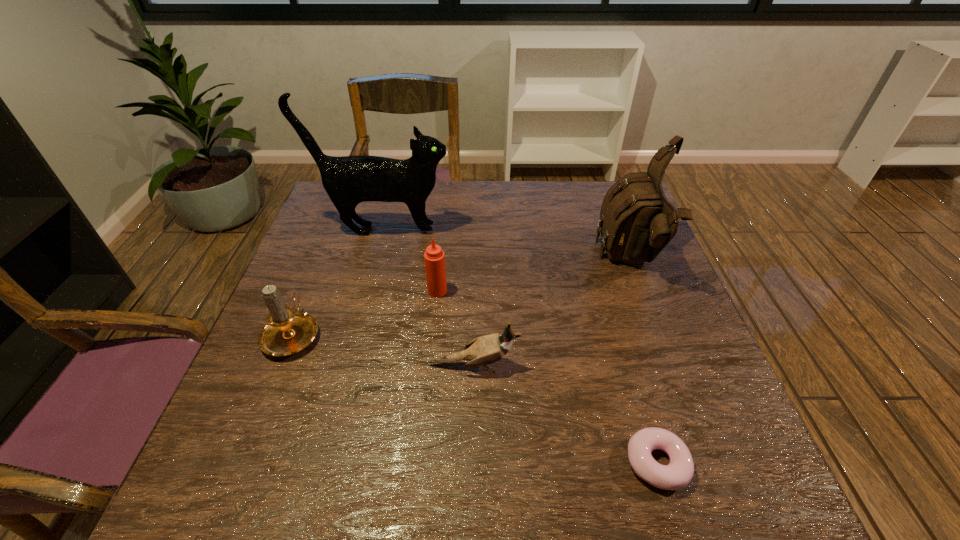
The image size is (960, 540). Identify the location of free space between the candle and the tallest object. [x=338, y=282].

In order to click on vacant point located between the bird and the Tabasco sauce in this screenshot , I will do `click(456, 328)`.

Where is `blank region between the Tabasco sauce and the shortest object`? blank region between the Tabasco sauce and the shortest object is located at coordinates (547, 377).

Find the location of a particular element. Image resolution: width=960 pixels, height=540 pixels. vacant space that's between the tallest object and the shoulder bag is located at coordinates (507, 245).

You are a GUI agent. You are given a task and a screenshot of the screen. Output one action in this format:
    pyautogui.click(x=<x>, y=<y>)
    Task: Click on the free spot between the Tabasco sauce and the shortest object
    The width and height of the screenshot is (960, 540).
    Given the screenshot: What is the action you would take?
    pyautogui.click(x=547, y=377)

Image resolution: width=960 pixels, height=540 pixels. I want to click on free space between the tallest object and the bird, so click(429, 298).

Identify the location of object that is the closest to the cat. (434, 257).

Point out which object is positioned as the fifth nearest to the Tabasco sauce. Please provide its 2D coordinates. Your answer should be formatted as a tuple, i.e. [(x, y)], where the tuple contains the x and y coordinates of a point satisfying the conditions above.

[(677, 474)]

Locate an element on the screen. The width and height of the screenshot is (960, 540). free space that satisfies the following two spatial constraints: 1. on the face of the tallest object; 2. on the left side of the shortest object is located at coordinates (322, 463).

Identify the location of blank space that satisfies the following two spatial constraints: 1. on the front side of the Tabasco sauce; 2. on the right side of the shortest object. Image resolution: width=960 pixels, height=540 pixels. (420, 463).